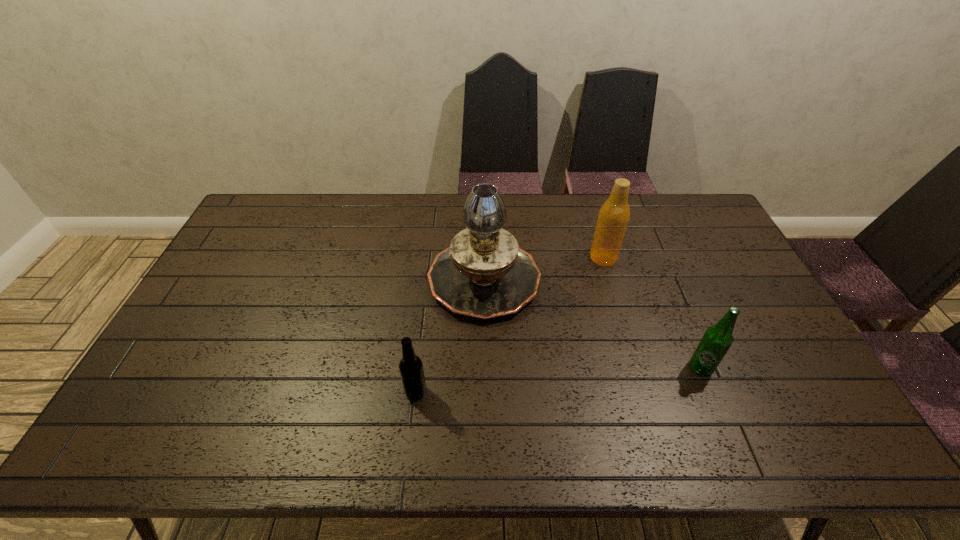
Select which beer bottle appears as the closest to the oil lamp. Please provide its 2D coordinates. Your answer should be formatted as a tuple, i.e. [(x, y)], where the tuple contains the x and y coordinates of a point satisfying the conditions above.

[(614, 215)]

Find the location of `vacant region that satisfies the following two spatial constraints: 1. on the back side of the leftmost beer bottle; 2. on the left side of the oil lamp`. vacant region that satisfies the following two spatial constraints: 1. on the back side of the leftmost beer bottle; 2. on the left side of the oil lamp is located at coordinates (429, 278).

Where is `free space that satisfies the following two spatial constraints: 1. on the back side of the second object from right to left; 2. on the right side of the oil lamp`? This screenshot has height=540, width=960. free space that satisfies the following two spatial constraints: 1. on the back side of the second object from right to left; 2. on the right side of the oil lamp is located at coordinates (484, 258).

At what (x,y) coordinates should I click in order to perform the action: click on vacant space that satisfies the following two spatial constraints: 1. on the back side of the nearest object; 2. on the right side of the oil lamp. Please return your answer as a coordinate pair (x, y). The image size is (960, 540). Looking at the image, I should click on (429, 278).

This screenshot has height=540, width=960. Identify the location of blank space that satisfies the following two spatial constraints: 1. on the back side of the leftmost beer bottle; 2. on the right side of the oil lamp. (429, 278).